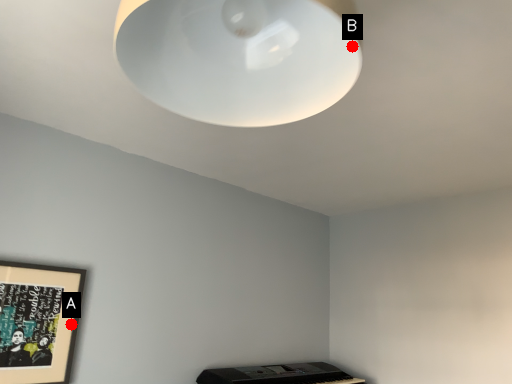
Question: Two points are circled on the image, labeled by A and B beside each circle. Which point is closer to the camera?

Choices:
 (A) A is closer
 (B) B is closer

Answer: (B)